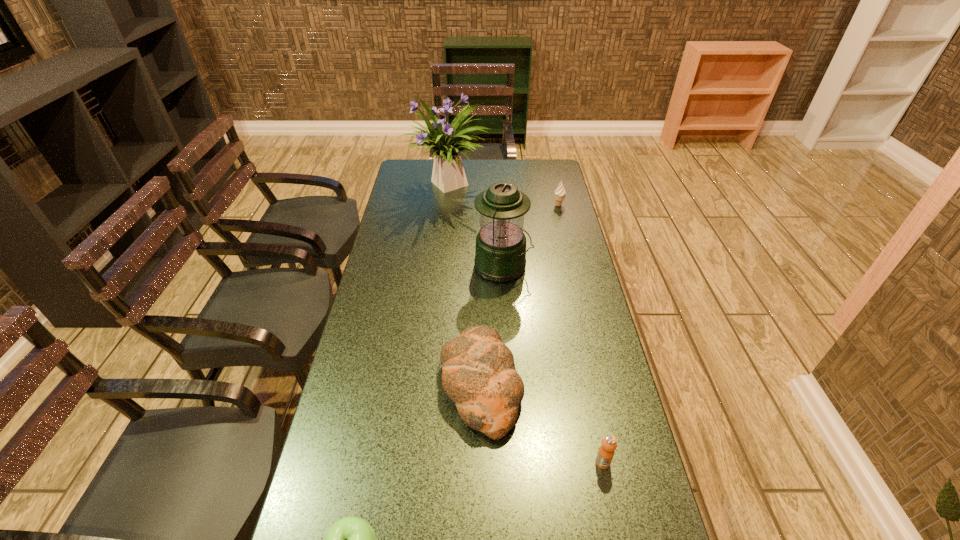
Identify the location of flower arrangement. (448, 174).

Locate an element on the screen. the fourth nearest object is located at coordinates (500, 254).

Locate an element on the screen. lantern is located at coordinates (500, 254).

The height and width of the screenshot is (540, 960). In order to click on the third nearest object in this screenshot , I will do `click(478, 371)`.

Where is `the rightmost object`? The height and width of the screenshot is (540, 960). the rightmost object is located at coordinates (560, 192).

The image size is (960, 540). Identify the location of the fifth farthest object. (605, 454).

I want to click on orange juice, so click(x=605, y=454).

Where is `vacant space located on the front of the tallest object`? vacant space located on the front of the tallest object is located at coordinates (443, 237).

The height and width of the screenshot is (540, 960). I want to click on vacant space located 0.190m on the front of the lantern, so click(x=506, y=327).

This screenshot has width=960, height=540. What are the coordinates of `free space located 0.160m on the back of the bread` in the screenshot? It's located at (481, 299).